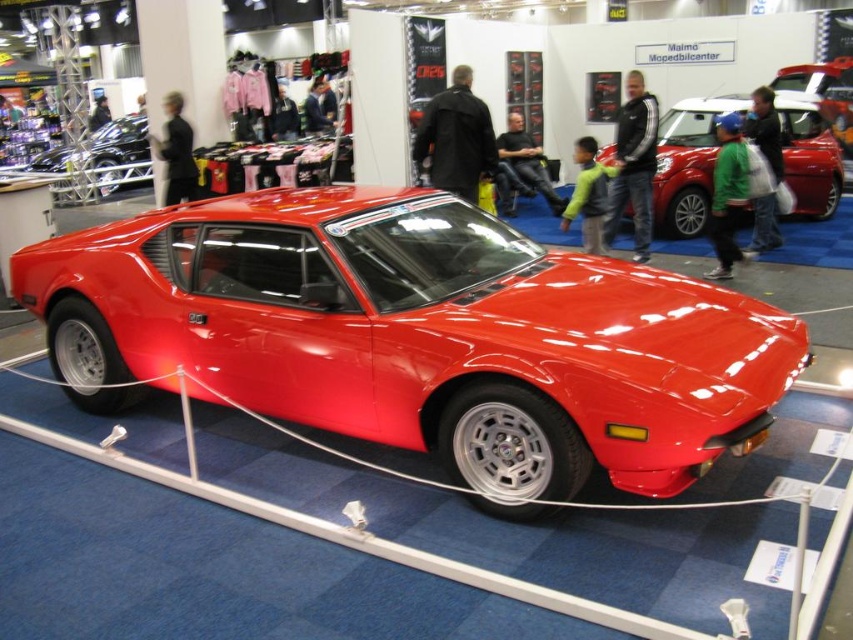
Question: Does glossy red sports car at center appear on the left side of shiny black car at left?

Choices:
 (A) yes
 (B) no

Answer: (B)

Question: Is shiny red car at center further to camera compared to shiny black car at left?

Choices:
 (A) yes
 (B) no

Answer: (B)

Question: Which point is farther to the camera?

Choices:
 (A) shiny red car at center
 (B) glossy red sports car at center
 (C) shiny black car at left

Answer: (C)

Question: Which object appears farthest from the camera in this image?

Choices:
 (A) shiny red car at center
 (B) glossy red sports car at center
 (C) shiny black car at left

Answer: (C)

Question: Is shiny red car at center to the right of shiny black car at left from the viewer's perspective?

Choices:
 (A) yes
 (B) no

Answer: (A)

Question: Which point appears farthest from the camera in this image?

Choices:
 (A) (581, 339)
 (B) (22, 168)

Answer: (B)